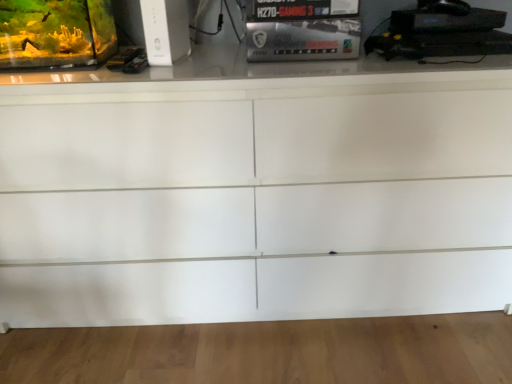
The height and width of the screenshot is (384, 512). Describe the element at coordinates (165, 30) in the screenshot. I see `white plastic console at upper center` at that location.

In order to face white plastic console at upper center, should I rotate leftwards or rightwards?

Rotate left and turn 11.688 degrees.

Measure the distance between white plastic console at upper center and camera.

The depth of white plastic console at upper center is 39.13 inches.

Find the location of a particular element. white plastic console at upper center is located at coordinates (165, 30).

The height and width of the screenshot is (384, 512). Identify the location of white plastic console at upper center. (165, 30).